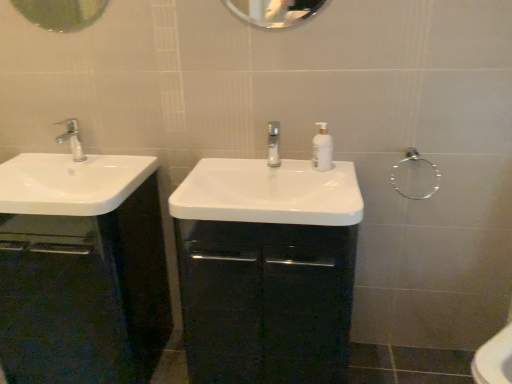
Find the location of a particular element. The height and width of the screenshot is (384, 512). blank space to the left of silver metallic faucet at left, the second tap when ordered from right to left is located at coordinates (32, 177).